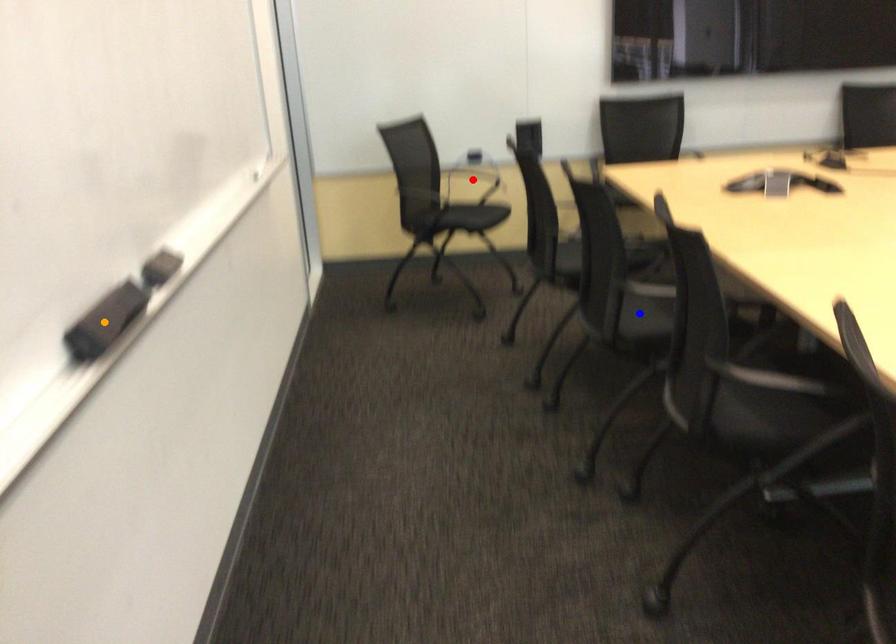
Order these from nearest to farthest:
A) blue point
B) red point
C) orange point

red point, blue point, orange point